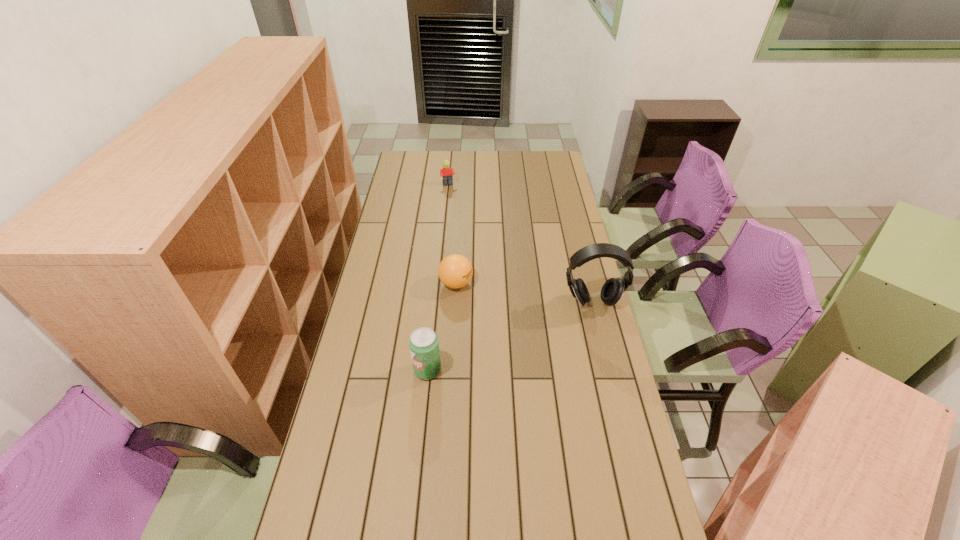
Image resolution: width=960 pixels, height=540 pixels. In order to click on vacant space that is in between the ping-pong ball and the second tallest object in this screenshot , I will do `click(442, 327)`.

Image resolution: width=960 pixels, height=540 pixels. I want to click on vacant area that lies between the ping-pong ball and the nearest object, so click(x=442, y=327).

This screenshot has width=960, height=540. In order to click on empty space that is in between the ping-pong ball and the nearest object in this screenshot , I will do `click(442, 327)`.

Locate an element on the screen. The image size is (960, 540). free point between the tallest object and the farthest object is located at coordinates (520, 244).

Locate an element on the screen. Image resolution: width=960 pixels, height=540 pixels. free spot between the farthest object and the second tallest object is located at coordinates (438, 278).

Find the location of a particular element. vacant space that's between the nearest object and the Lego is located at coordinates (438, 278).

Identify the location of vacant point located between the second tallest object and the rightmost object. The width and height of the screenshot is (960, 540). (510, 336).

Find the location of a particular element. This screenshot has width=960, height=540. free space between the earphone and the ping-pong ball is located at coordinates (524, 293).

Locate which object is the closest to the farthest object. Please provide its 2D coordinates. Your answer should be formatted as a tuple, i.e. [(x, y)], where the tuple contains the x and y coordinates of a point satisfying the conditions above.

[(455, 271)]

I want to click on the closest object to the earphone, so click(455, 271).